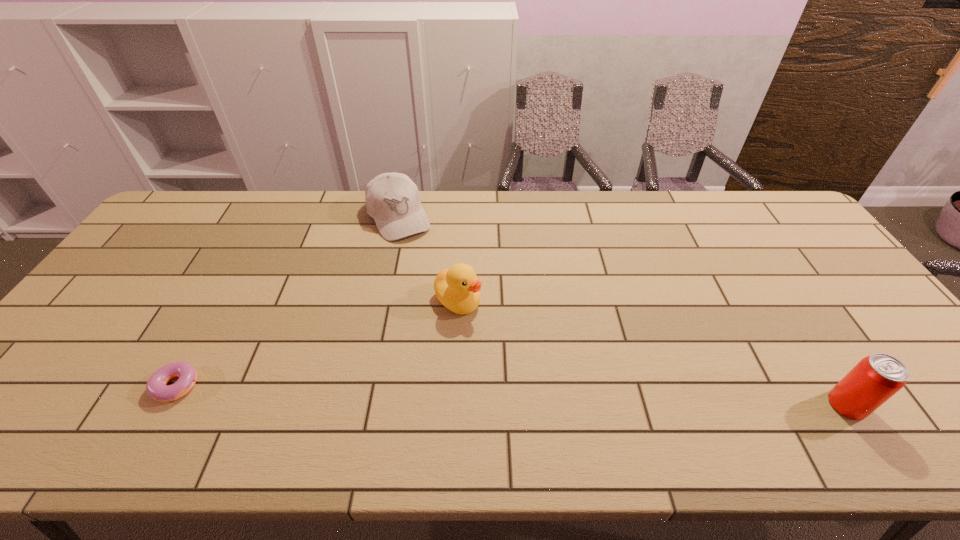
This screenshot has height=540, width=960. What are the coordinates of `blank area at the left edge` in the screenshot? It's located at (59, 373).

Identify the location of vacant space at the right edge of the desktop. The image size is (960, 540). (834, 267).

Find the location of a particular element. vacant area at the far left corner of the desktop is located at coordinates click(x=203, y=234).

The height and width of the screenshot is (540, 960). Identify the location of blank space at the near right corner of the desktop. (924, 395).

The height and width of the screenshot is (540, 960). I want to click on empty space that is in between the second farthest object and the farthest object, so click(429, 258).

Find the location of a particular element. free space between the baseball cap and the second farthest object is located at coordinates (429, 258).

Find the location of a particular element. The image size is (960, 540). blank region between the shortest object and the third nearest object is located at coordinates (319, 340).

Where is `free space between the farthest object and the rightmost object`? free space between the farthest object and the rightmost object is located at coordinates (623, 310).

The image size is (960, 540). In order to click on free space between the doughnut and the rightmost object in this screenshot , I will do `click(513, 393)`.

Locate an element on the screen. This screenshot has width=960, height=540. free space that is in between the leftmost object and the baseball cap is located at coordinates (289, 299).